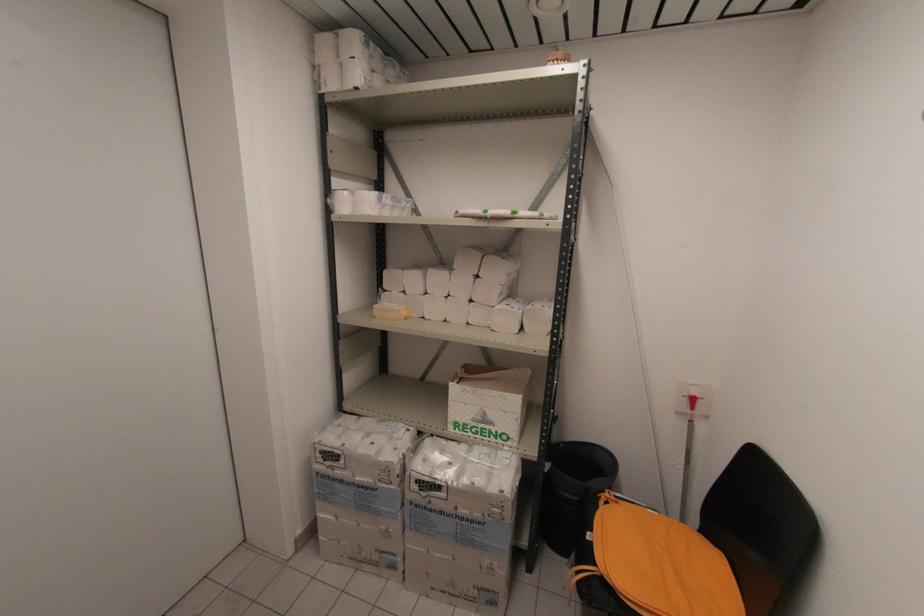
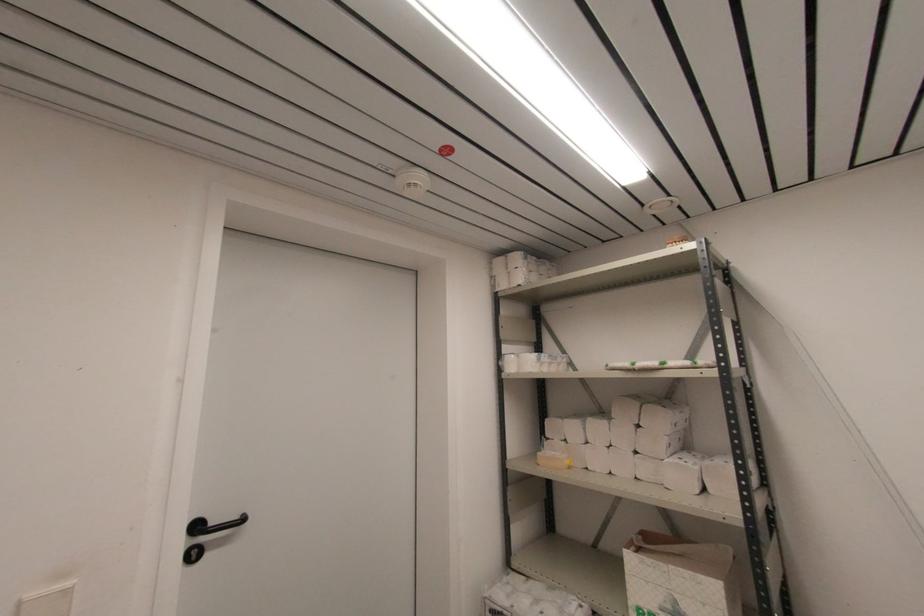
The images are taken continuously from a first-person perspective. In which direction is your viewpoint rotating?

The camera rotated toward left-up.